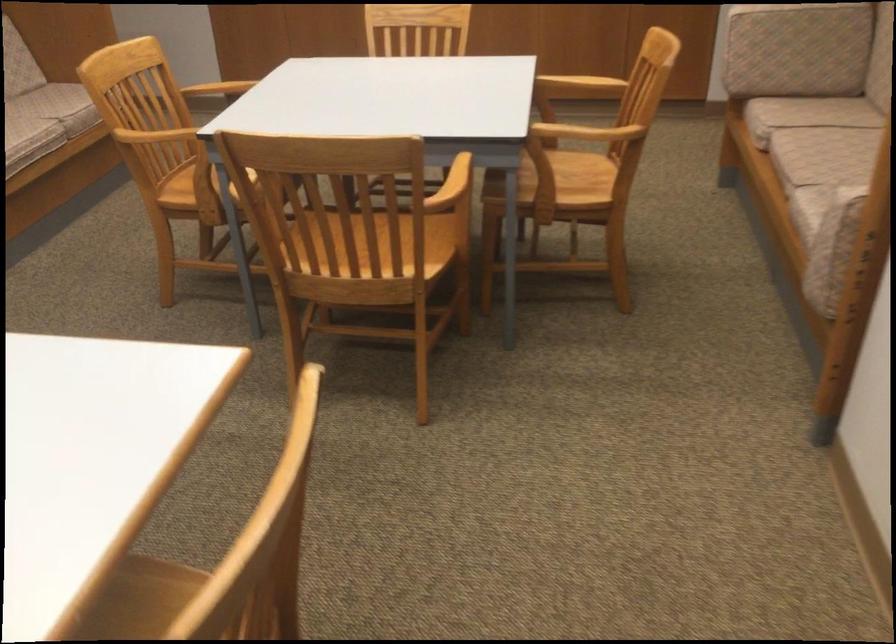
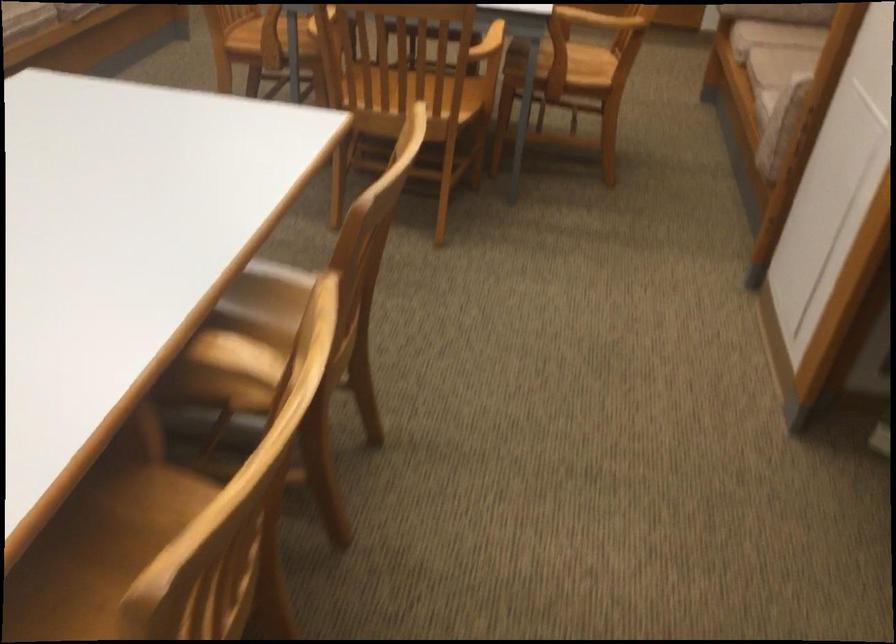
Question: In a continuous first-person perspective shot, in which direction is the camera moving?

Choices:
 (A) Left
 (B) Right
 (C) Forward
 (D) Backward

Answer: (D)